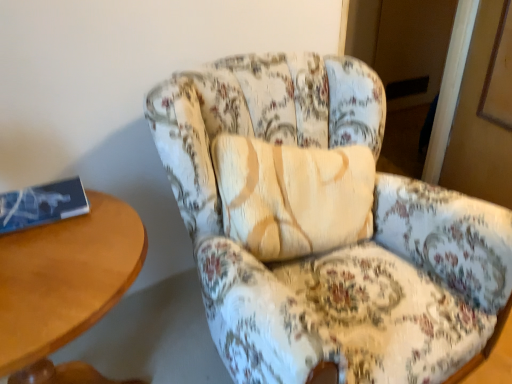
Question: Relative to floral fabric armchair at center, is blue paper book at left in front or behind?

Choices:
 (A) front
 (B) behind

Answer: (B)

Question: Is point (48, 185) positioned closer to the camera than point (464, 322)?

Choices:
 (A) farther
 (B) closer

Answer: (B)

Question: Considering the real-world distances, which object is farthest from the blue paper book at left?

Choices:
 (A) floral fabric armchair at center
 (B) wooden table at left

Answer: (A)

Question: Which of these objects is positioned closest to the floral fabric armchair at center?

Choices:
 (A) blue paper book at left
 (B) wooden table at left

Answer: (B)